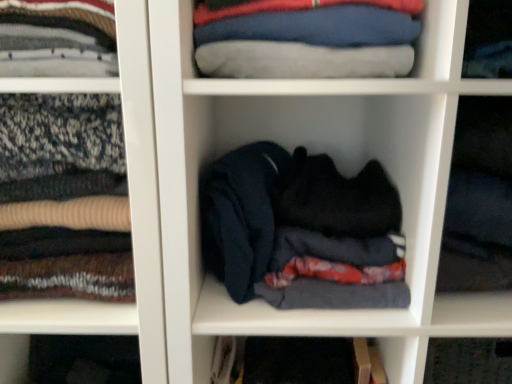
Question: Choose the correct answer: Is blue cotton shirt at upper center inside dark blue fabric at center, which ranks as the 1th cabinet in left-to-right order, or outside it?

Choices:
 (A) outside
 (B) inside

Answer: (A)

Question: Does point tap(222, 36) appear closer or farther from the camera than point tap(97, 79)?

Choices:
 (A) farther
 (B) closer

Answer: (B)

Question: Estimate the real-world distances between objects in this image. Which object is closer to the black fabric at center, placed as the third cabinet when sorted from left to right?

Choices:
 (A) dark fabric at center, marked as the second cabinet in a left-to-right arrangement
 (B) dark blue fabric at center, the third cabinet viewed from the right
 (C) blue cotton shirt at upper center

Answer: (A)

Question: Estimate the real-world distances between objects in this image. Which object is closer to the dark blue fabric at center, which ranks as the 1th cabinet in left-to-right order?

Choices:
 (A) blue cotton shirt at upper center
 (B) black fabric at center, placed as the third cabinet when sorted from left to right
 (C) dark fabric at center, which ranks as the 2th cabinet in right-to-left order

Answer: (A)